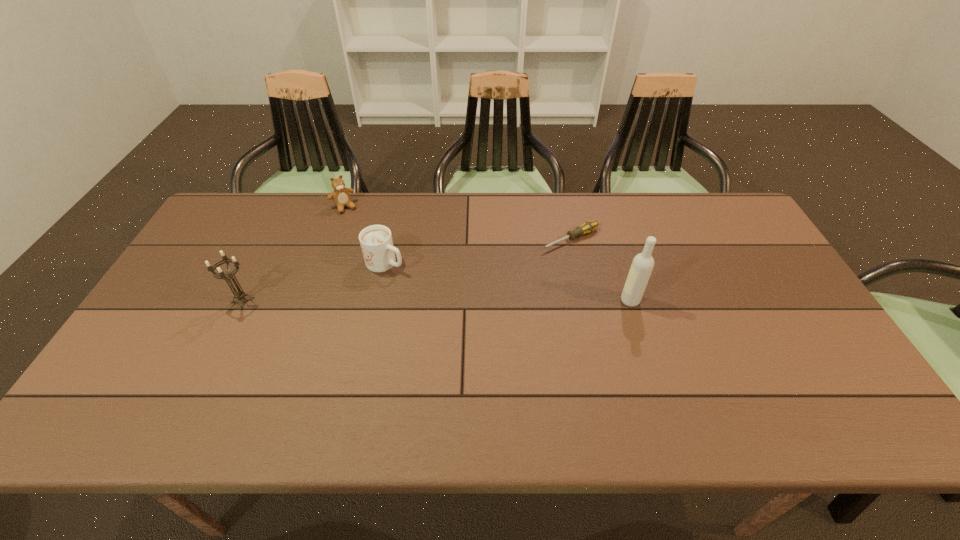
Find the location of a particular element. This screenshot has width=960, height=540. free space that satisfies the following two spatial constraints: 1. on the back side of the cappuccino; 2. on the right side of the second tallest object is located at coordinates (261, 263).